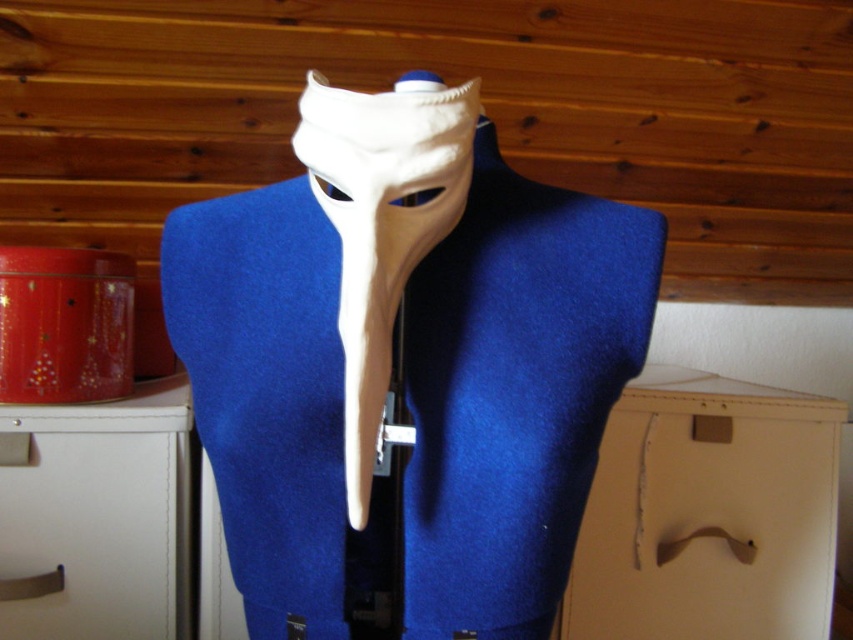
Is blue felt jacket at center thinner than white matte mask at center?

Incorrect, blue felt jacket at center's width is not less than white matte mask at center's.

Does blue felt jacket at center appear on the right side of white matte mask at center?

Yes, blue felt jacket at center is to the right of white matte mask at center.

Which is in front, point (281, 529) or point (422, 100)?

Point (422, 100)

You are a GUI agent. You are given a task and a screenshot of the screen. Output one action in this format:
    pyautogui.click(x=<x>, y=<y>)
    Task: Click on the blue felt jacket at center
    The height and width of the screenshot is (640, 853).
    Given the screenshot: What is the action you would take?
    pyautogui.click(x=514, y=394)

Can you confirm if beige cardboard drawer at lower right is positioned to the right of white matte mask at center?

Yes, beige cardboard drawer at lower right is to the right of white matte mask at center.

Does beige cardboard drawer at lower right have a smaller size compared to white matte mask at center?

No, beige cardboard drawer at lower right is not smaller than white matte mask at center.

Which is in front, point (704, 621) or point (418, 221)?

Point (418, 221) is in front.

Locate an element on the screen. The width and height of the screenshot is (853, 640). beige cardboard drawer at lower right is located at coordinates (708, 515).

Who is positioned more to the right, blue felt jacket at center or beige cardboard drawer at lower right?

beige cardboard drawer at lower right is more to the right.

Does blue felt jacket at center have a smaller size compared to beige cardboard drawer at lower right?

Yes, blue felt jacket at center is smaller than beige cardboard drawer at lower right.

Between point (549, 422) and point (663, 476), which one is positioned behind?

Positioned behind is point (663, 476).

Where is `blue felt jacket at center`? blue felt jacket at center is located at coordinates (514, 394).